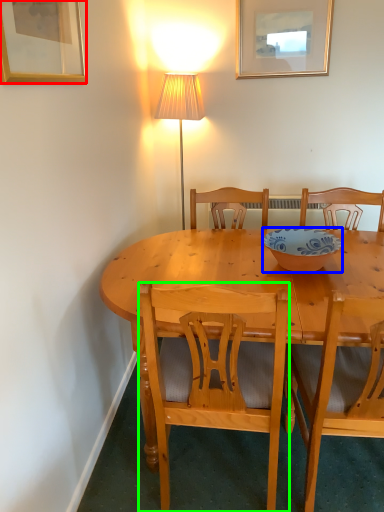
Question: Which is farther away from picture frame (highlighted by a red box)? bowl (highlighted by a blue box) or chair (highlighted by a green box)?

Choices:
 (A) bowl
 (B) chair

Answer: (A)